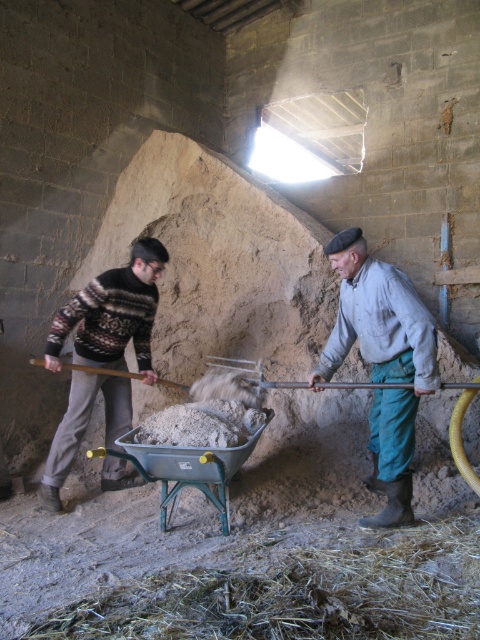
You are a contractor assessing the layout of this room. You need to place a new tool rack that can hold both the gray cotton shirt at center and the wooden handle shovel at left. Based on their positions, where should you place the tool rack to be equidistant from both items?

The gray cotton shirt at center is above the wooden handle shovel at left. To place the tool rack equidistant from both items, position it midway between their vertical positions, ensuring it is centered horizontally between them as well.